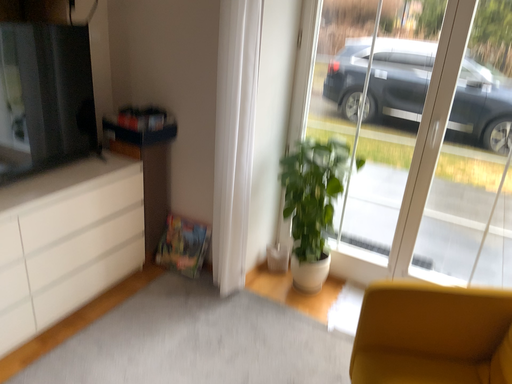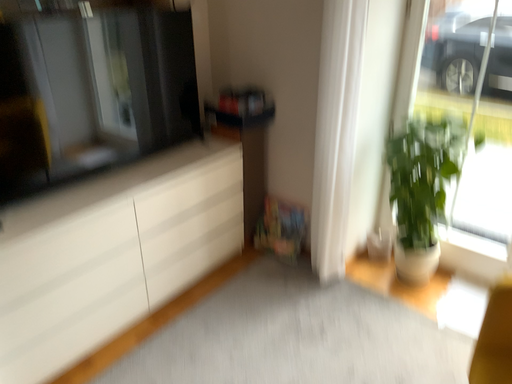
Question: How did the camera likely rotate when shooting the video?

Choices:
 (A) rotated left
 (B) rotated right

Answer: (A)